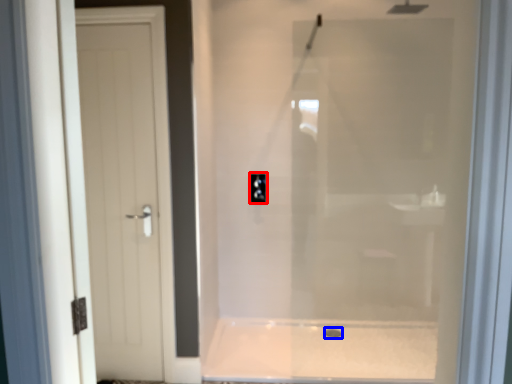
Question: Which object appears closest to the camera in this image, electric outlet (highlighted by a red box) or drain (highlighted by a blue box)?

Choices:
 (A) electric outlet
 (B) drain

Answer: (B)